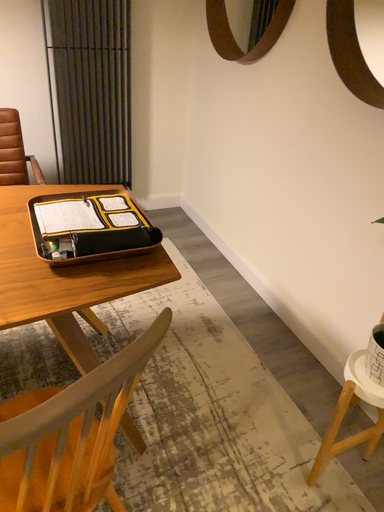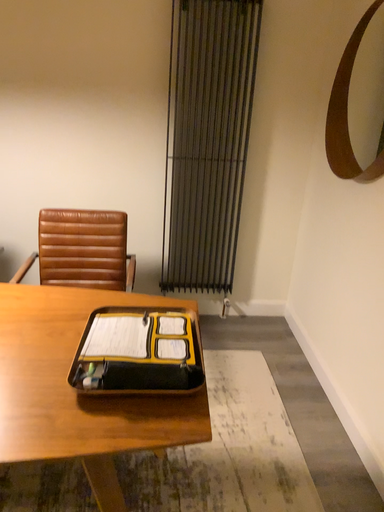
Question: Which way did the camera rotate in the video?

Choices:
 (A) rotated left
 (B) rotated right

Answer: (A)